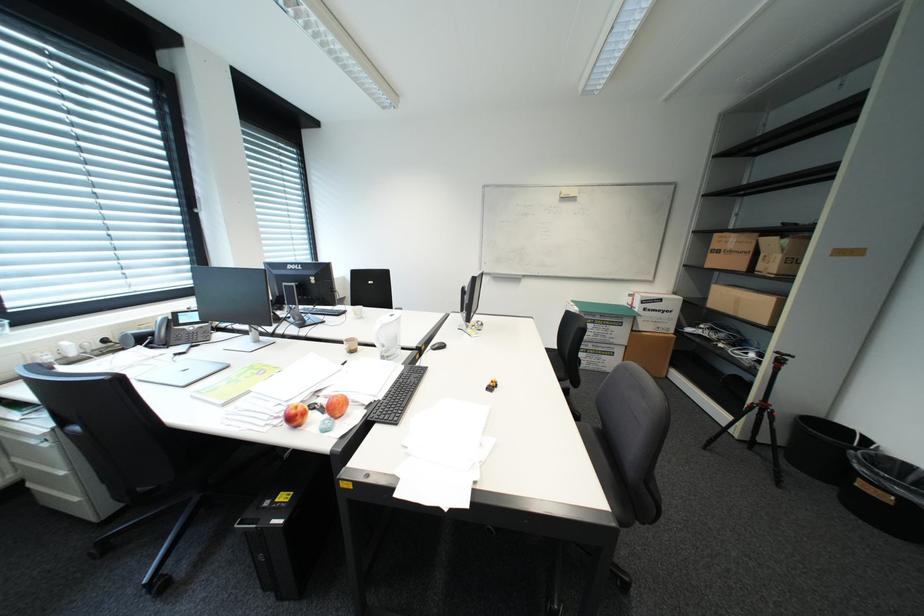
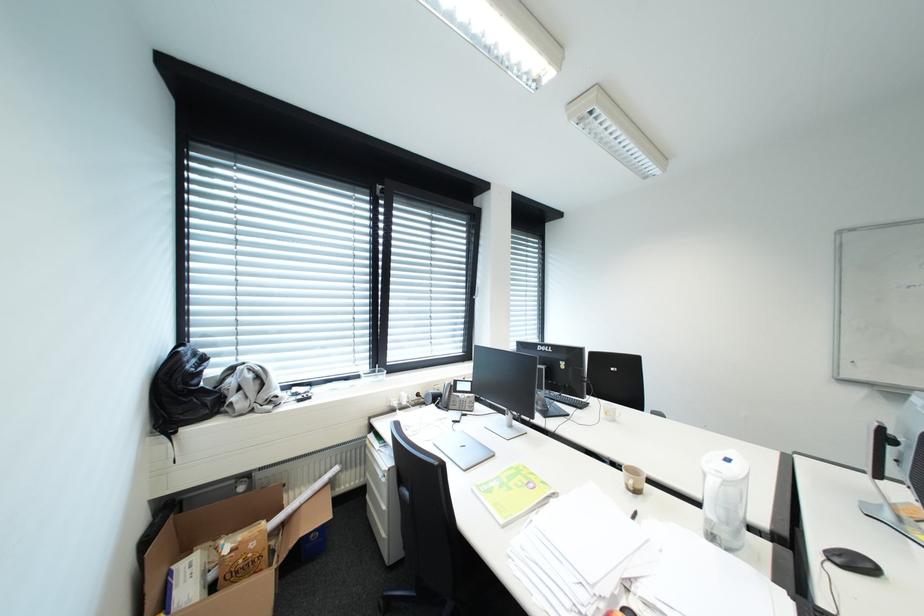
Question: The camera is either moving clockwise (left) or counter-clockwise (right) around the object. The first image is from the beginning of the video and the second image is from the end. Is the camera moving left or right when shooting the video?

Choices:
 (A) Left
 (B) Right

Answer: (B)